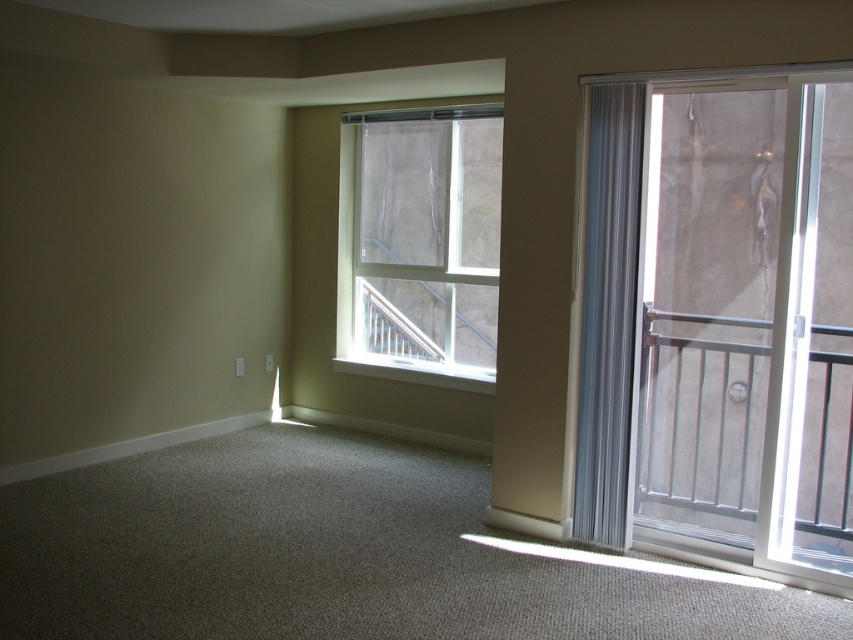
Does clear glass window at upper center have a lesser height compared to gray sheer curtain at right?

Yes, clear glass window at upper center is shorter than gray sheer curtain at right.

The width and height of the screenshot is (853, 640). I want to click on clear glass window at upper center, so click(x=421, y=243).

Image resolution: width=853 pixels, height=640 pixels. Identify the location of clear glass window at upper center. [x=421, y=243].

Who is more forward, (827, 563) or (386, 272)?

Point (827, 563)

Does clear glass door at right appear over clear glass window at upper center?

Actually, clear glass door at right is below clear glass window at upper center.

Is point (706, 275) in front of point (403, 152)?

That is False.

The image size is (853, 640). Identify the location of clear glass door at right. (747, 323).

Between point (757, 550) and point (630, 157), which one is positioned behind?

Point (630, 157)

Locate an element on the screen. The height and width of the screenshot is (640, 853). clear glass door at right is located at coordinates (747, 323).

Is point (840, 280) farther from camera compared to point (625, 216)?

Yes, it is.

Identify the location of clear glass door at right. (747, 323).